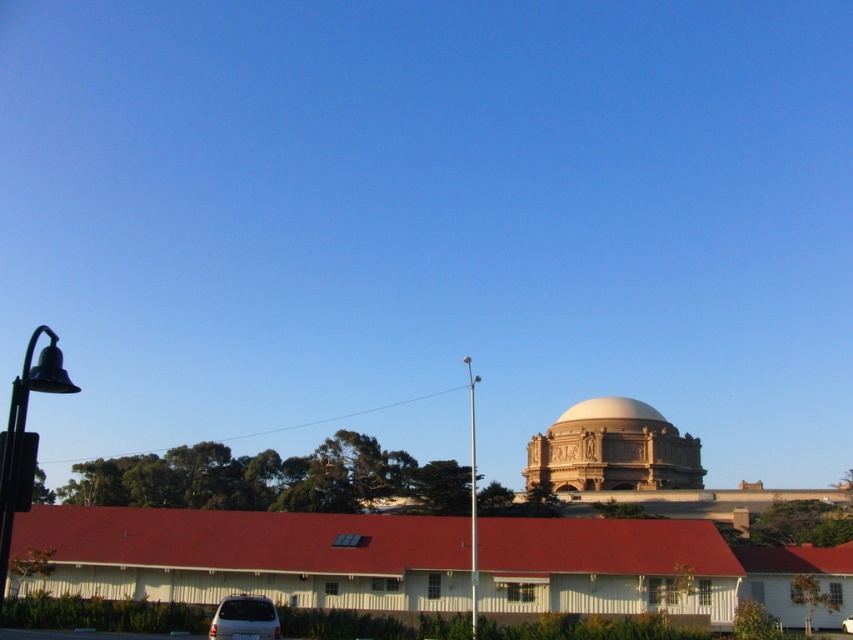
You are a delivery person trying to park your 1.2 meter wide delivery cart between the black metal bell at left and the white smooth dome at center. Can you fit your cart there?

The black metal bell at left might be wider than white smooth dome at center, so the space between them may not be sufficient for your 1.2 meter wide delivery cart. Check the actual width before attempting to park.

You are standing at the point marked by the coordinates point (566, 467). You want to walk to the historic building with the dome in the background. Is the historic building with the dome in the background located in front of or behind you?

The point (566, 467) is 454.97 feet away from the viewer. Since the historic building with the dome in the background is in the background of the image, it is located behind the point (566, 467), so it would be behind you.

You are standing in front of the historic building with the dome and want to take a photo. There are two points marked in the image at coordinates point (25, 385) and point (578, 413). Which point is closer to your current position?

Point (25, 385) is closer to the camera than point (578, 413), so it is closer to your current position.